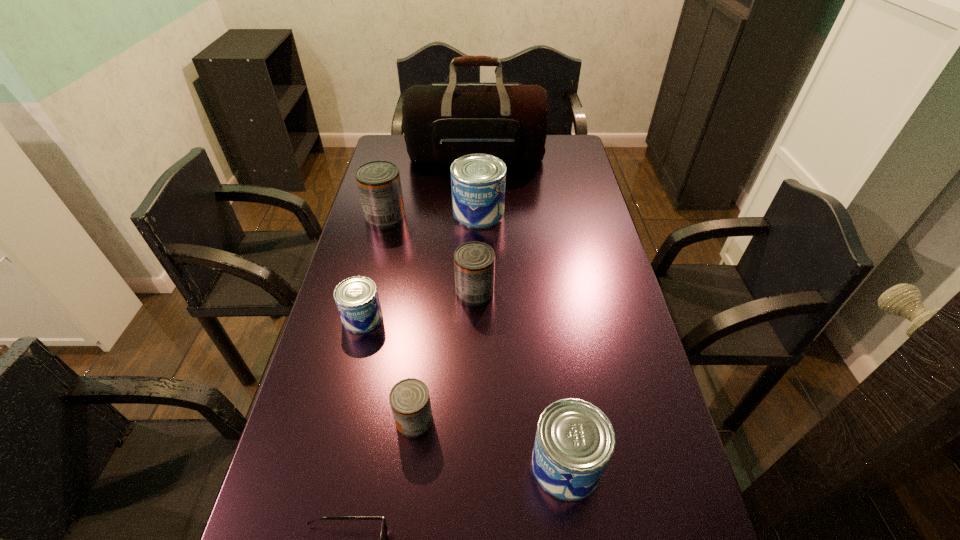
The height and width of the screenshot is (540, 960). What are the coordinates of `vacant space located on the front label of the second biggest blue can` in the screenshot? It's located at (359, 464).

The width and height of the screenshot is (960, 540). What are the coordinates of `vacant area situated on the front of the smallest red can` in the screenshot? It's located at tap(410, 461).

I want to click on vacant position located 0.230m on the front label of the second farthest blue can, so click(x=339, y=414).

The image size is (960, 540). I want to click on object situated at the far edge, so click(x=442, y=122).

Image resolution: width=960 pixels, height=540 pixels. I want to click on duffel bag located in the left edge section of the desktop, so click(x=442, y=122).

Where is `duffel bag situated at the right edge`? The image size is (960, 540). duffel bag situated at the right edge is located at coordinates (442, 122).

Image resolution: width=960 pixels, height=540 pixels. Identify the location of can at the right edge. [574, 442].

At what (x,y) coordinates should I click in order to perform the action: click on object located in the far left corner section of the desktop. Please return your answer as a coordinate pair (x, y). The width and height of the screenshot is (960, 540). Looking at the image, I should click on (442, 122).

You are a GUI agent. You are given a task and a screenshot of the screen. Output one action in this format:
    pyautogui.click(x=<x>, y=<y>)
    Task: Click on the object that is at the far right corner
    The image size is (960, 540).
    Given the screenshot: What is the action you would take?
    pyautogui.click(x=442, y=122)

The width and height of the screenshot is (960, 540). Identify the location of vacant space at the left edge. (373, 349).